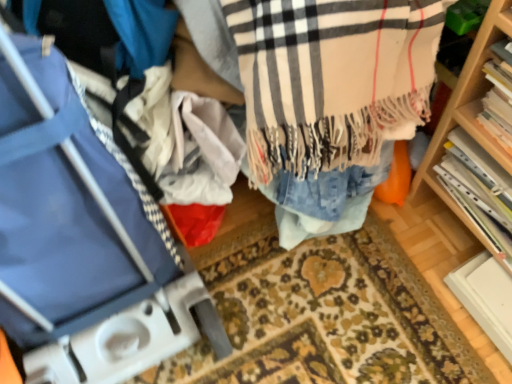
Question: Is beige plaid scarf at center situated inside hardcover book at right, arranged as the 2th book when viewed from the front, or outside?

Choices:
 (A) inside
 (B) outside

Answer: (B)

Question: In terms of width, does beige plaid scarf at center look wider or thinner when compared to hardcover book at right, the 1th book when ordered from back to front?

Choices:
 (A) thin
 (B) wide

Answer: (B)

Question: Estimate the real-world distances between objects in this image. Which object is farther from the hardcover book at right, arranged as the 2th book when viewed from the front?

Choices:
 (A) beige plaid scarf at center
 (B) blue fabric luggage at left
 (C) hardcover book at right, placed as the first book when sorted from front to back

Answer: (B)

Question: Based on their relative distances, which object is nearer to the blue fabric luggage at left?

Choices:
 (A) beige plaid scarf at center
 (B) hardcover book at right, the 1th book when ordered from back to front
 (C) hardcover book at right, placed as the first book when sorted from front to back

Answer: (A)